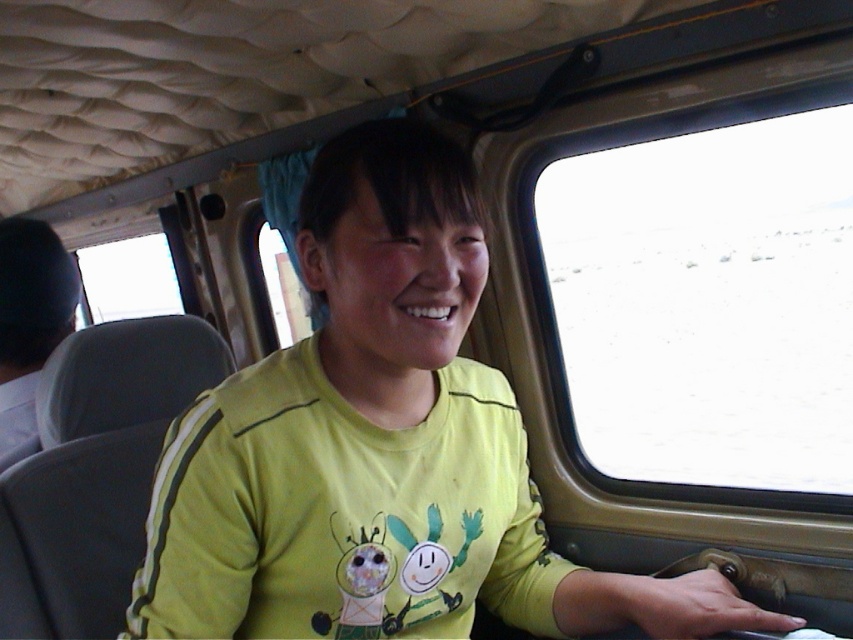
The width and height of the screenshot is (853, 640). Describe the element at coordinates (701, 294) in the screenshot. I see `transparent glass window at right` at that location.

Is transparent glass window at right positioned behind transparent glass window at center?

That is True.

Does point (624, 125) come behind point (260, 248)?

No, it is in front of (260, 248).

This screenshot has height=640, width=853. What are the coordinates of `transparent glass window at right` in the screenshot? It's located at (701, 294).

Does transparent glass window at upper left lie behind transparent glass window at center?

That is True.

Can you confirm if transparent glass window at upper left is positioned to the right of transparent glass window at center?

No, transparent glass window at upper left is not to the right of transparent glass window at center.

Which is in front, point (170, 260) or point (292, 323)?

Positioned in front is point (292, 323).

Identify the location of transparent glass window at upper left. (128, 280).

Is yellow fabric shirt at center below transparent glass window at upper left?

Indeed, yellow fabric shirt at center is positioned under transparent glass window at upper left.

Is the position of yellow fabric shirt at center less distant than that of transparent glass window at upper left?

Yes, yellow fabric shirt at center is closer to the viewer.

Find the location of a particular element. The image size is (853, 640). yellow fabric shirt at center is located at coordinates (28, 324).

Image resolution: width=853 pixels, height=640 pixels. In order to click on yellow fabric shirt at center in this screenshot , I will do `click(28, 324)`.